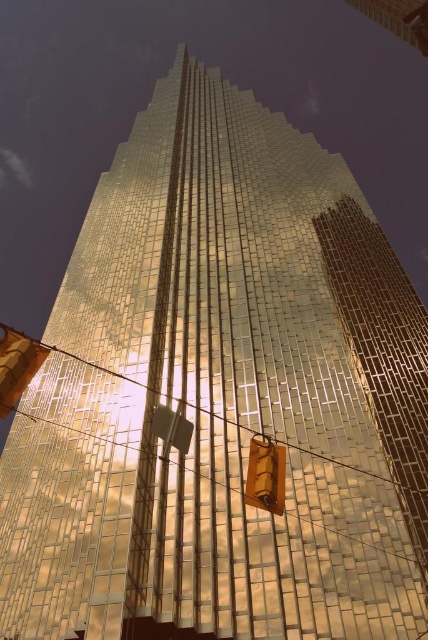
You are a pedestrian standing at the base of the skyscraper and see the matte orange traffic light at lower left and the metallic gold traffic light at center. Which traffic light appears larger to you?

The matte orange traffic light at lower left appears larger than the metallic gold traffic light at center because it is closer to you.

You are a delivery drone operator. Your drone is currently hovering above the matte orange traffic light at lower left. You need to fly it to the metallic gold traffic light at center. Given that the drone has a maximum flight range of 15 meters, will it be able to reach the destination without recharging?

The matte orange traffic light at lower left is 14.64 meters away from the metallic gold traffic light at center. Since the distance is within the drone maximum flight range of 15 meters, the drone can reach the destination without recharging.

You are standing at the base of the skyscraper and want to take a photo of the building. There is a matte orange traffic light at lower left in your view. Where should you position the traffic light in your camera frame to capture it at point 0.573, 0.040?

Position the matte orange traffic light at lower left at coordinates 0.573 on the x axis and 0.040 on the y axis in your camera frame to capture it accurately.